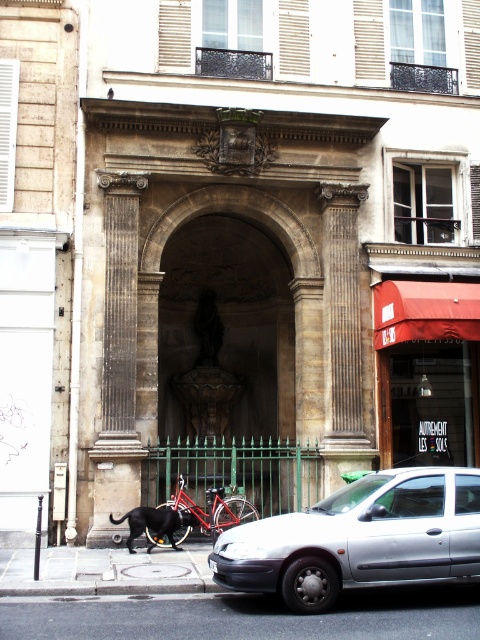
You are standing in front of the historic building and want to install a new red fabric awning. Where should you place it to match the existing red fabric awning at lower right?

The existing red fabric awning at lower right is located at coordinates point [427,371], so you should place the new one at the same position to match it.